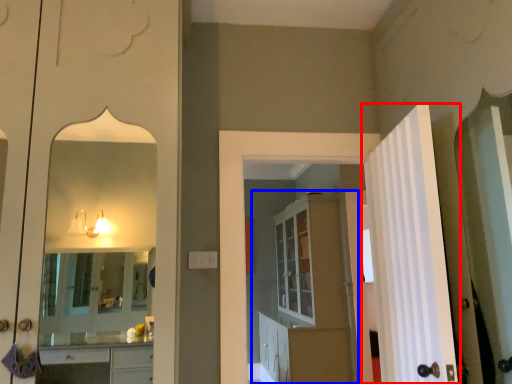
Question: Which object is closer to the camera taking this photo, door (highlighted by a red box) or dresser (highlighted by a blue box)?

Choices:
 (A) door
 (B) dresser

Answer: (A)